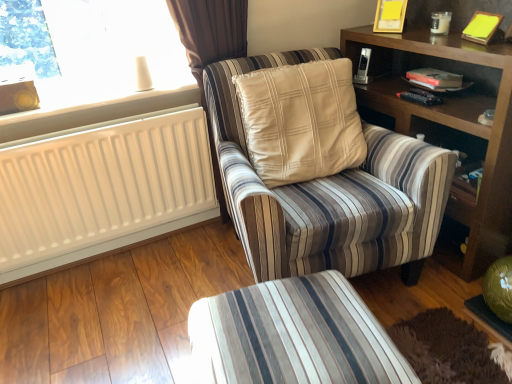
You are a GUI agent. You are given a task and a screenshot of the screen. Output one action in this format:
    pyautogui.click(x=<x>, y=<y>)
    Task: Click on the white plastic radiator at upper left
    
    Given the screenshot: What is the action you would take?
    pyautogui.click(x=94, y=110)

In order to face white matte radiator at left, should I rotate leftwards or rightwards?

Rotate left and turn 20.135 degrees.

Where is `white plastic radiator at upper left`? The width and height of the screenshot is (512, 384). white plastic radiator at upper left is located at coordinates (94, 110).

Who is shorter, striped fabric chair at center or white plastic radiator at upper left?

Standing shorter between the two is white plastic radiator at upper left.

Between striped fabric chair at center and white plastic radiator at upper left, which one appears on the right side from the viewer's perspective?

striped fabric chair at center.

Considering the sizes of striped fabric chair at center and white plastic radiator at upper left in the image, is striped fabric chair at center wider or thinner than white plastic radiator at upper left?

Considering their sizes, striped fabric chair at center looks broader than white plastic radiator at upper left.

Which of these two, striped fabric ottoman at lower center or wooden bookshelf at right, is smaller?

striped fabric ottoman at lower center is smaller.

From a real-world perspective, is striped fabric ottoman at lower center beneath wooden bookshelf at right?

Yes, from a real-world perspective, striped fabric ottoman at lower center is below wooden bookshelf at right.

Considering the positions of objects striped fabric ottoman at lower center and wooden bookshelf at right in the image provided, who is in front, striped fabric ottoman at lower center or wooden bookshelf at right?

striped fabric ottoman at lower center is in front.

How distant is striped fabric ottoman at lower center from wooden bookshelf at right?

striped fabric ottoman at lower center is 35.49 inches from wooden bookshelf at right.

From the image's perspective, is wooden bookshelf at right over yellow paper at upper right?

No.

Considering the relative positions of wooden bookshelf at right and yellow paper at upper right in the image provided, is wooden bookshelf at right to the left or to the right of yellow paper at upper right?

wooden bookshelf at right is to the left of yellow paper at upper right.

Choose the correct answer: Is wooden bookshelf at right inside yellow paper at upper right or outside it?

wooden bookshelf at right is not enclosed by yellow paper at upper right.

Is wooden bookshelf at right facing towards yellow paper at upper right?

No, wooden bookshelf at right is not facing towards yellow paper at upper right.

From a real-world perspective, is white matte radiator at left above or below striped fabric chair at center?

In terms of real-world spatial position, white matte radiator at left is below striped fabric chair at center.

Is white matte radiator at left smaller than striped fabric chair at center?

Correct, white matte radiator at left occupies less space than striped fabric chair at center.

Considering the relative sizes of white matte radiator at left and striped fabric chair at center in the image provided, is white matte radiator at left wider than striped fabric chair at center?

Incorrect, the width of white matte radiator at left does not surpass that of striped fabric chair at center.

Where is `chair above the white matte radiator at left (from a real-world perspective)`? chair above the white matte radiator at left (from a real-world perspective) is located at coordinates (329, 193).

Which is nearer, (256, 239) or (274, 310)?

Clearly, point (256, 239) is more distant from the camera than point (274, 310).

Locate an element on the screen. The height and width of the screenshot is (384, 512). chair on the right of striped fabric ottoman at lower center is located at coordinates (329, 193).

Does striped fabric chair at center have a greater height compared to striped fabric ottoman at lower center?

Yes.

From the picture: Is striped fabric chair at center next to striped fabric ottoman at lower center and touching it?

No, striped fabric chair at center is not with striped fabric ottoman at lower center.

Based on the photo, does striped fabric ottoman at lower center have a greater height compared to white matte radiator at left?

In fact, striped fabric ottoman at lower center may be shorter than white matte radiator at left.

Could white matte radiator at left be considered to be inside striped fabric ottoman at lower center?

No, white matte radiator at left is located outside of striped fabric ottoman at lower center.

From a real-world perspective, is striped fabric ottoman at lower center positioned above or below white matte radiator at left?

striped fabric ottoman at lower center is below white matte radiator at left.

Between white matte radiator at left and yellow paper at upper right, which one appears on the right side from the viewer's perspective?

yellow paper at upper right.

In terms of width, does white matte radiator at left look wider or thinner when compared to yellow paper at upper right?

Considering their sizes, white matte radiator at left looks broader than yellow paper at upper right.

Is white matte radiator at left not inside yellow paper at upper right?

white matte radiator at left is positioned outside yellow paper at upper right.

In the image, there is a striped fabric chair at center. Where is `window sill above it (from the image's perspective)`? window sill above it (from the image's perspective) is located at coordinates (94, 110).

You are a GUI agent. You are given a task and a screenshot of the screen. Output one action in this format:
    pyautogui.click(x=<x>, y=<y>)
    Task: Click on the table that is in front of the wooden bookshelf at right
    
    Given the screenshot: What is the action you would take?
    pyautogui.click(x=293, y=336)

Estimate the real-world distances between objects in this image. Which object is further from white matte radiator at left, striped fabric chair at center or yellow paper at upper right?

yellow paper at upper right.

When comparing their distances from white matte radiator at left, does yellow paper at upper right or striped fabric ottoman at lower center seem further?

yellow paper at upper right lies further to white matte radiator at left than the other object.

Which object lies nearer to the anchor point yellow paper at upper right, striped fabric ottoman at lower center or striped fabric chair at center?

Among the two, striped fabric chair at center is located nearer to yellow paper at upper right.

Based on their spatial positions, is yellow paper at upper right or striped fabric chair at center closer to wooden bookshelf at right?

yellow paper at upper right is closer to wooden bookshelf at right.

Which object lies nearer to the anchor point wooden bookshelf at right, striped fabric ottoman at lower center or white matte radiator at left?

Among the two, striped fabric ottoman at lower center is located nearer to wooden bookshelf at right.

Considering their positions, is white plastic radiator at upper left positioned closer to striped fabric ottoman at lower center than white matte radiator at left?

Based on the image, white matte radiator at left appears to be nearer to striped fabric ottoman at lower center.

From the image, which object appears to be nearer to striped fabric ottoman at lower center, white matte radiator at left or striped fabric chair at center?

The object closer to striped fabric ottoman at lower center is striped fabric chair at center.

Estimate the real-world distances between objects in this image. Which object is closer to striped fabric ottoman at lower center, striped fabric chair at center or wooden bookshelf at right?

striped fabric chair at center is closer to striped fabric ottoman at lower center.

What are the coordinates of `chair between white plastic radiator at upper left and yellow paper at upper right` in the screenshot? It's located at (329, 193).

Locate an element on the screen. Image resolution: width=512 pixels, height=384 pixels. shelf located between white plastic radiator at upper left and yellow paper at upper right in the left-right direction is located at coordinates (450, 124).

You are a GUI agent. You are given a task and a screenshot of the screen. Output one action in this format:
    pyautogui.click(x=<x>, y=<y>)
    Task: Click on the chair between white plastic radiator at upper left and wooden bookshelf at right
    
    Given the screenshot: What is the action you would take?
    pyautogui.click(x=329, y=193)

At what (x,y) coordinates should I click in order to perform the action: click on radiator situated between white plastic radiator at upper left and striped fabric ottoman at lower center from left to right. Please return your answer as a coordinate pair (x, y). The image size is (512, 384). Looking at the image, I should click on (102, 188).